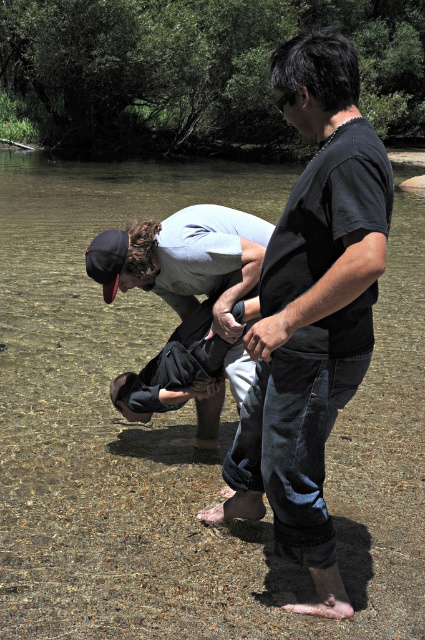
Is black matte shirt at center taller than light gray cotton shirt at center?

Correct, black matte shirt at center is much taller as light gray cotton shirt at center.

Is black matte shirt at center shorter than light gray cotton shirt at center?

In fact, black matte shirt at center may be taller than light gray cotton shirt at center.

Locate an element on the screen. This screenshot has height=640, width=425. black matte shirt at center is located at coordinates (311, 310).